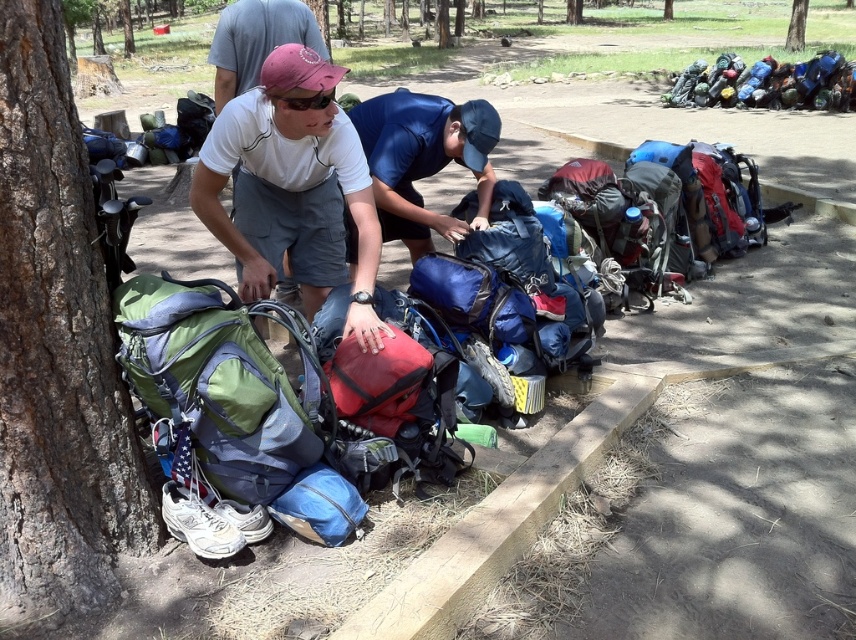
Looking at this image, you are standing at the camera position and want to pick up the item closest to you. Which point should you go to, point (36,16) or point (764,186)?

Point (36,16) is closer to the camera than point (764,186), so you should go to point (36,16) to pick up the item closest to you.